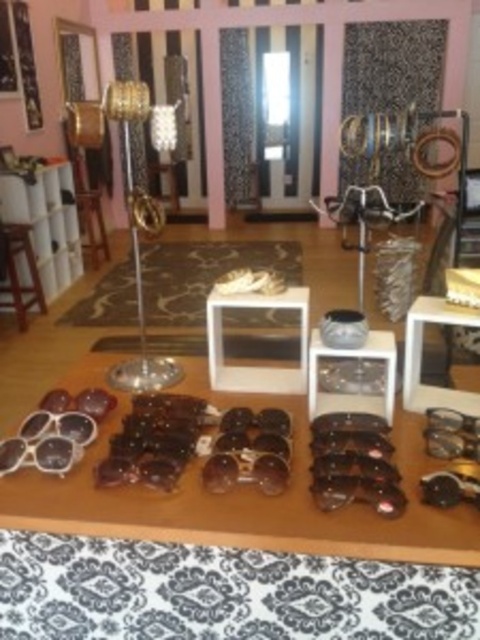
Question: Which object is closer to the camera taking this photo?

Choices:
 (A) matte black sunglasses at lower right
 (B) metallic silver goggles at lower right

Answer: (A)

Question: Considering the relative positions of wooden stool at left and matte black sunglasses at lower right in the image provided, where is wooden stool at left located with respect to matte black sunglasses at lower right?

Choices:
 (A) below
 (B) above

Answer: (B)

Question: Is matte black sunglasses at lower left below black plastic sunglasses at center?

Choices:
 (A) yes
 (B) no

Answer: (B)

Question: Which point is closer to the camera taking this photo?

Choices:
 (A) pyautogui.click(x=383, y=500)
 (B) pyautogui.click(x=475, y=499)
 (C) pyautogui.click(x=474, y=426)

Answer: (A)

Question: Which of the following is the closest to the observer?

Choices:
 (A) matte brown sunglasses at center
 (B) wooden stool at left

Answer: (A)

Question: Does brown leather sunglasses at center have a greater width compared to matte brown sunglasses at center?

Choices:
 (A) no
 (B) yes

Answer: (B)